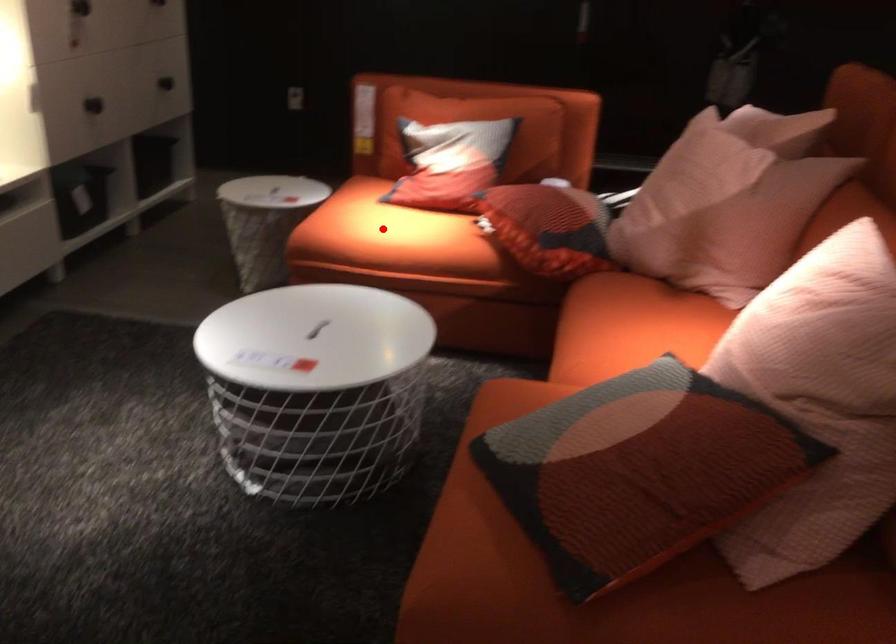
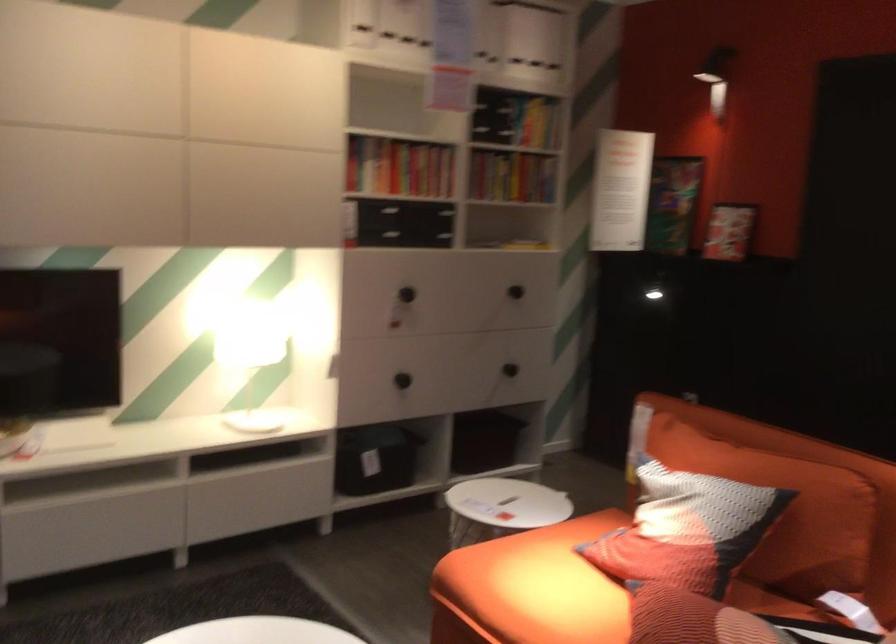
Question: A red point is marked in image1. In image2, is the corresponding 3D point closer to the camera or farther? Reply with the corresponding letter.

Choices:
 (A) The corresponding 3D point is closer.
 (B) The corresponding 3D point is farther.

Answer: (A)